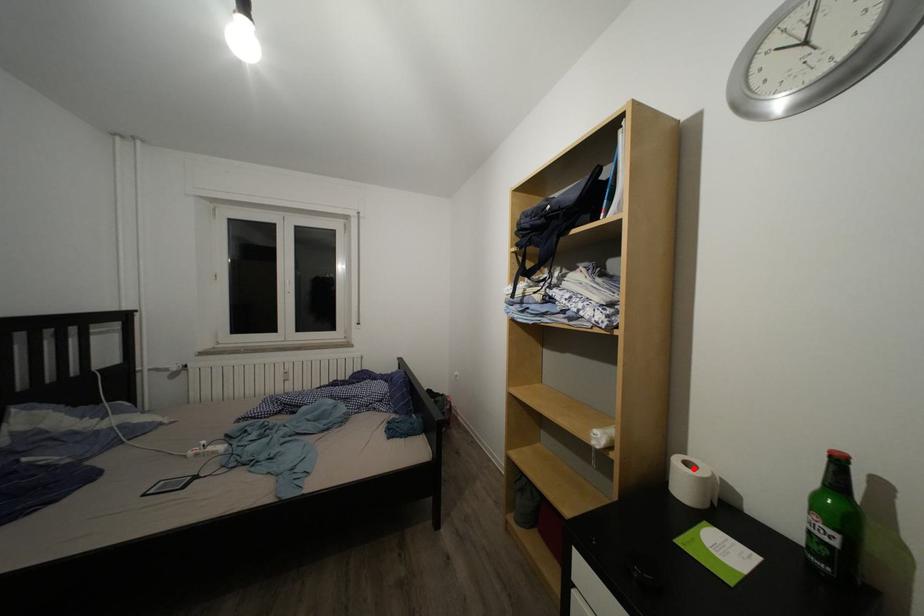
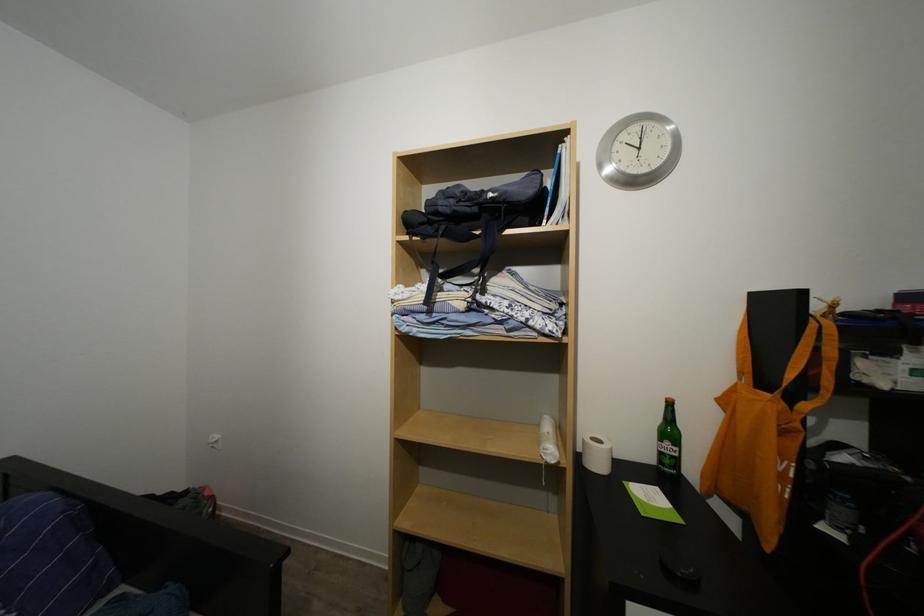
Question: I am providing you with two images of the same scene from different viewpoints. A red point is shown in image1. For the corresponding object point in image2, is it positioned nearer or farther from the camera?

Choices:
 (A) Nearer
 (B) Farther

Answer: (B)